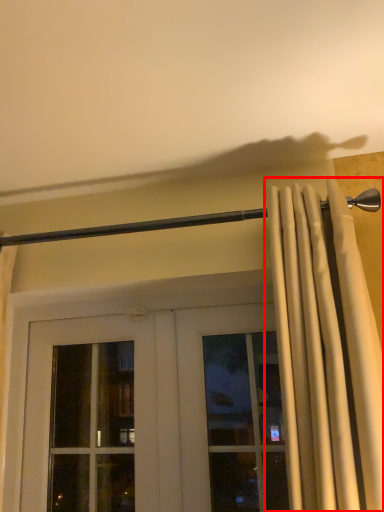
Question: From the image's perspective, what is the correct spatial positioning of curtain (annotated by the red box) in reference to beam?

Choices:
 (A) above
 (B) below

Answer: (B)